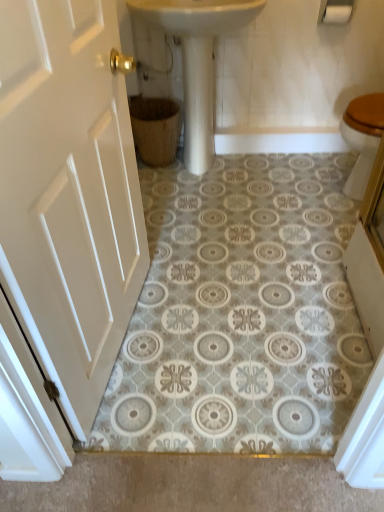
Question: From the image's perspective, is white painted wood door at left above or below white glossy sink at center?

Choices:
 (A) below
 (B) above

Answer: (A)

Question: Is white painted wood door at left inside the boundaries of white glossy sink at center, or outside?

Choices:
 (A) inside
 (B) outside

Answer: (B)

Question: Estimate the real-world distances between objects in this image. Which object is farther from the woven brown basket at lower center?

Choices:
 (A) white painted wood door at left
 (B) white matte toilet paper at upper right
 (C) white glossy sink at center

Answer: (A)

Question: Estimate the real-world distances between objects in this image. Which object is closer to the white painted wood door at left?

Choices:
 (A) white matte toilet paper at upper right
 (B) white glossy sink at center
 (C) woven brown basket at lower center

Answer: (B)